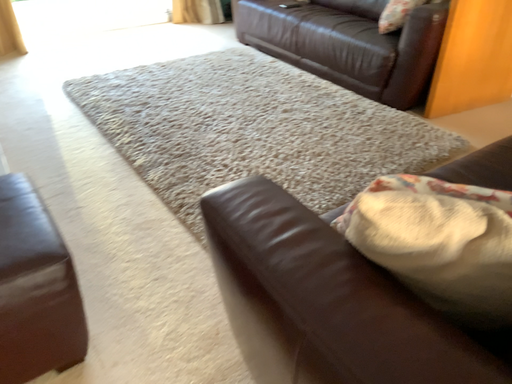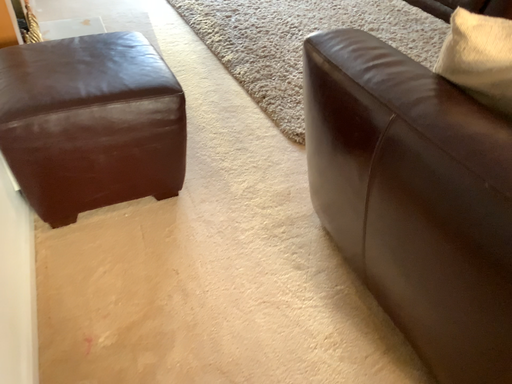
Question: How did the camera likely rotate when shooting the video?

Choices:
 (A) rotated left
 (B) rotated right

Answer: (A)